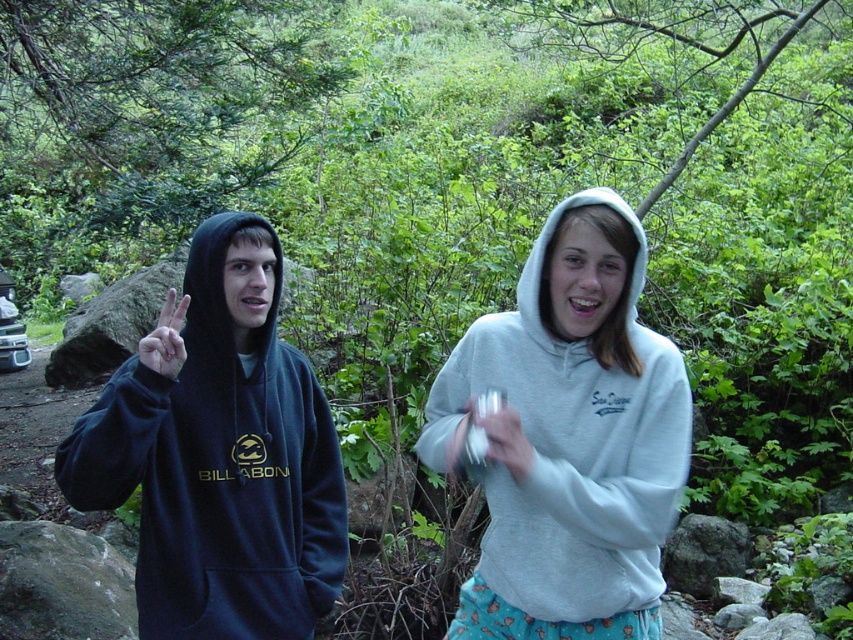
Question: Which of the following is the closest to the observer?

Choices:
 (A) (515, 444)
 (B) (585, 369)
 (C) (141, 394)
 (D) (178, 337)

Answer: (A)

Question: Which object appears farthest from the camera in this image?

Choices:
 (A) matte black hand at center
 (B) gray fleece hoodie at center

Answer: (B)

Question: Does matte black hand at center have a greater width compared to white matte hand at center?

Choices:
 (A) no
 (B) yes

Answer: (B)

Question: Does gray fleece hoodie at center come in front of white matte hand at center?

Choices:
 (A) yes
 (B) no

Answer: (B)

Question: Is dark blue hoodie at center smaller than dark blue fleece hoodie at left?

Choices:
 (A) no
 (B) yes

Answer: (B)

Question: Which object is farther from the camera taking this photo?

Choices:
 (A) dark blue fleece hoodie at left
 (B) dark blue hoodie at center
 (C) matte black hand at center

Answer: (A)